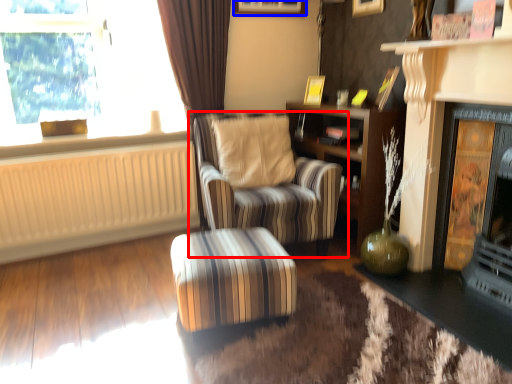
Question: Which point is further to the camera, chair (highlighted by a red box) or picture frame (highlighted by a blue box)?

Choices:
 (A) chair
 (B) picture frame

Answer: (B)